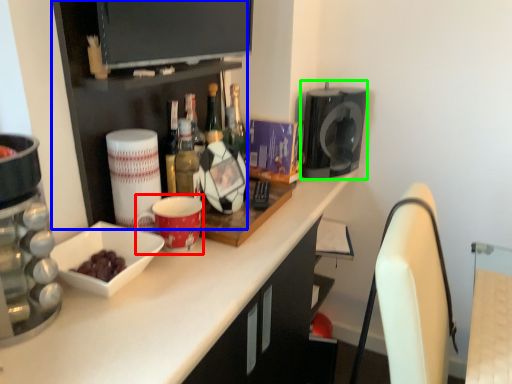
Question: Considering the real-world distances, which object is farthest from mug (highlighted by a red box)? shelf (highlighted by a blue box) or appliance (highlighted by a green box)?

Choices:
 (A) shelf
 (B) appliance

Answer: (B)